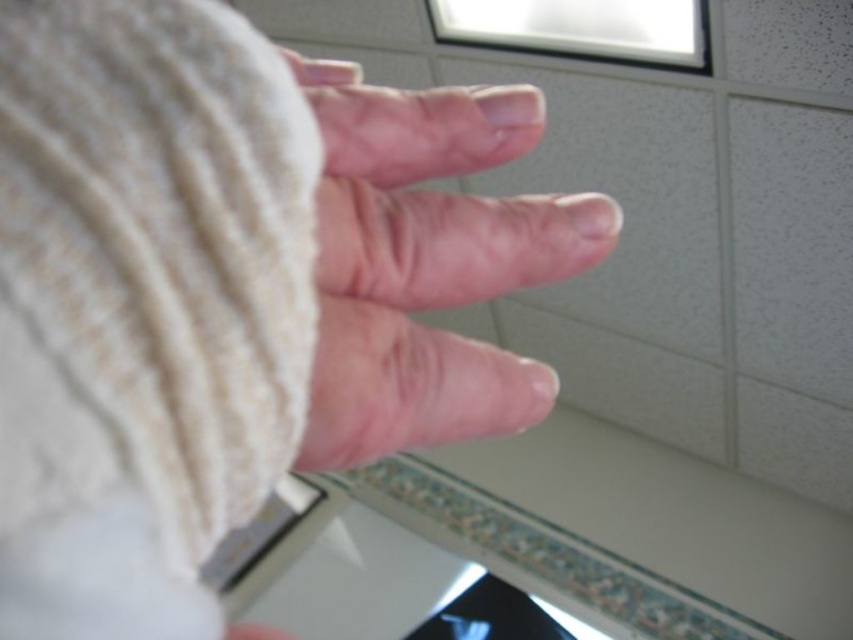
You are an interior designer working on a project and need to place a decorative item exactly at the position where the white knitted hand at center is located. What are the coordinates of that position?

The coordinates of the white knitted hand at center are at point [231,292].